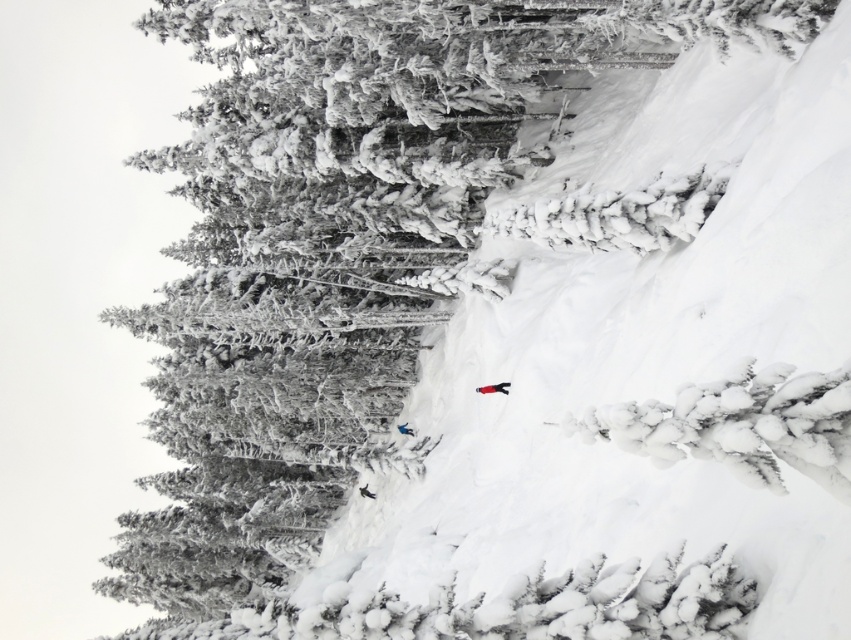
Question: Can you confirm if white matte snowboard at center is smaller than white matte snowboarder at center?

Choices:
 (A) no
 (B) yes

Answer: (A)

Question: Does white matte snowboard at center come in front of white matte snowboarder at center?

Choices:
 (A) no
 (B) yes

Answer: (B)

Question: Which of the following is the closest to the observer?

Choices:
 (A) (407, 422)
 (B) (507, 387)

Answer: (B)

Question: Can you confirm if white matte snowboard at center is positioned above white matte snowboarder at center?

Choices:
 (A) yes
 (B) no

Answer: (A)